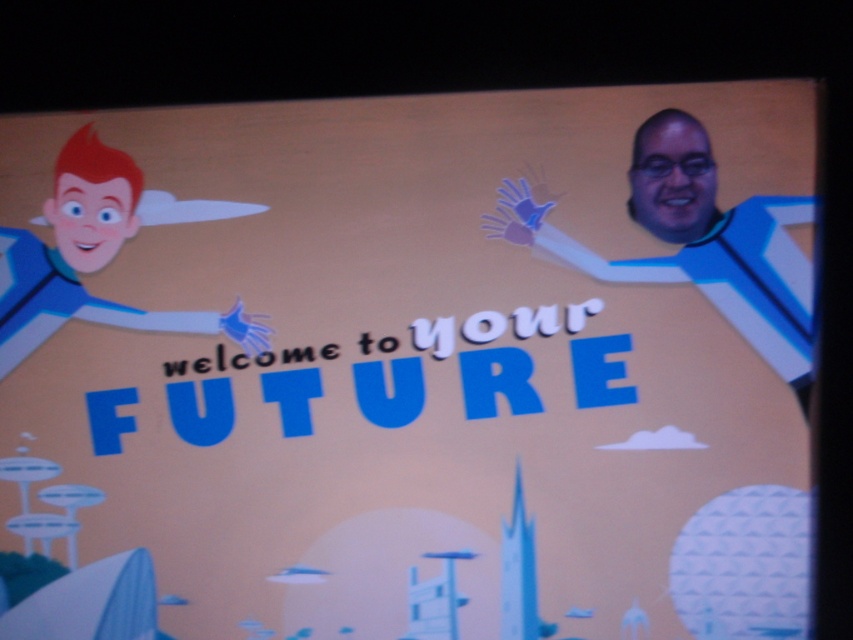
Question: Does blue plastic man at right appear on the left side of smooth blue suit at left?

Choices:
 (A) no
 (B) yes

Answer: (A)

Question: Which of the following is the farthest from the observer?

Choices:
 (A) (689, 228)
 (B) (21, 333)

Answer: (B)

Question: Is blue plastic man at right wider than smooth blue suit at left?

Choices:
 (A) no
 (B) yes

Answer: (B)

Question: Can you confirm if blue plastic man at right is wider than smooth blue suit at left?

Choices:
 (A) yes
 (B) no

Answer: (A)